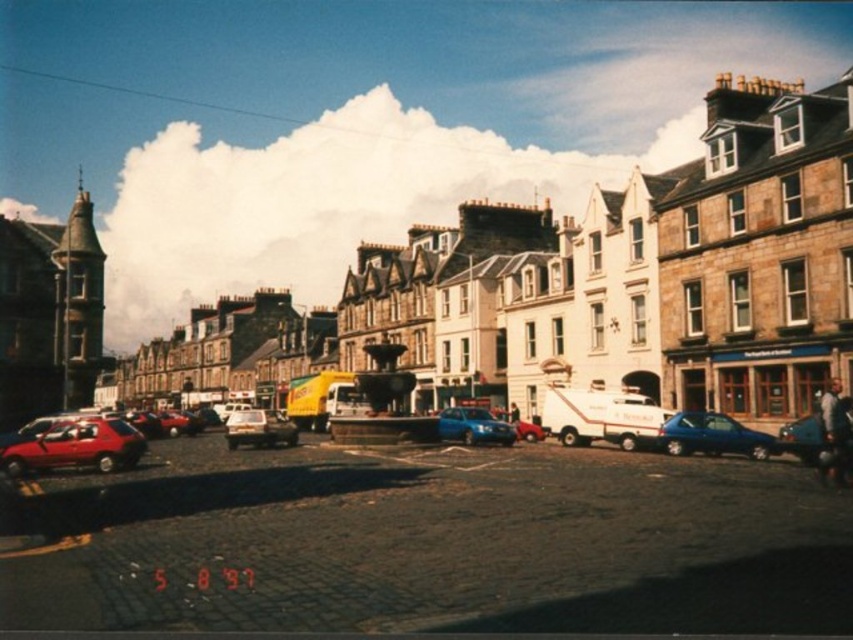
You are a tour guide leading a group through the historic town. You notice a shiny silver car at center and a blue metallic car at center. Which car would you mention to your group as being larger in size?

The shiny silver car at center is bigger than the blue metallic car at center, so I would mention the shiny silver car at center as the larger one.

You are standing on the street in the historic town and want to take a photo of both the point at coordinates (486, 417) and the point at coordinates (788, 436). Which point should you focus on first to ensure both are in focus?

You should focus on the point at coordinates (486, 417) first because it is closer to the camera than the point at coordinates (788, 436). This ensures both points will be in focus as the closer point sets the focal plane.